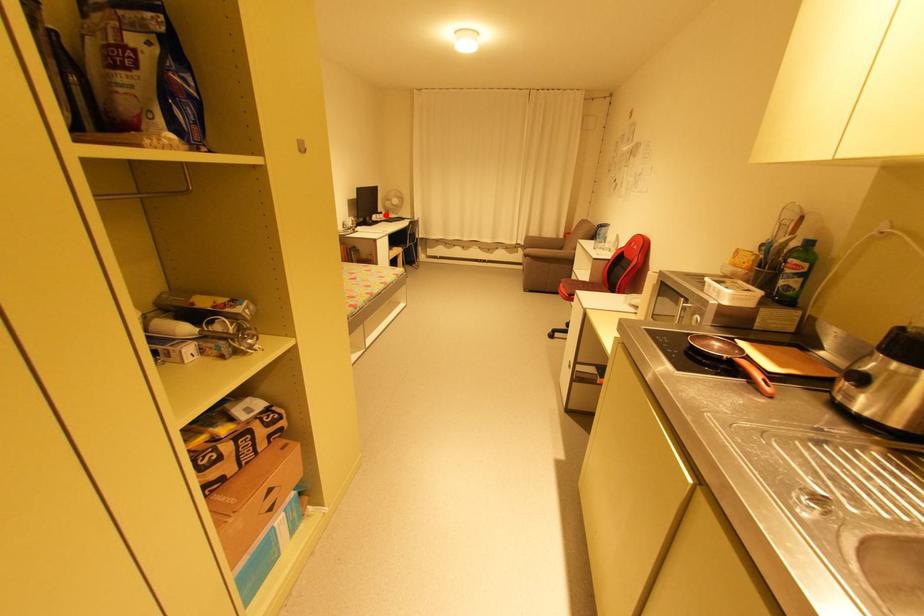
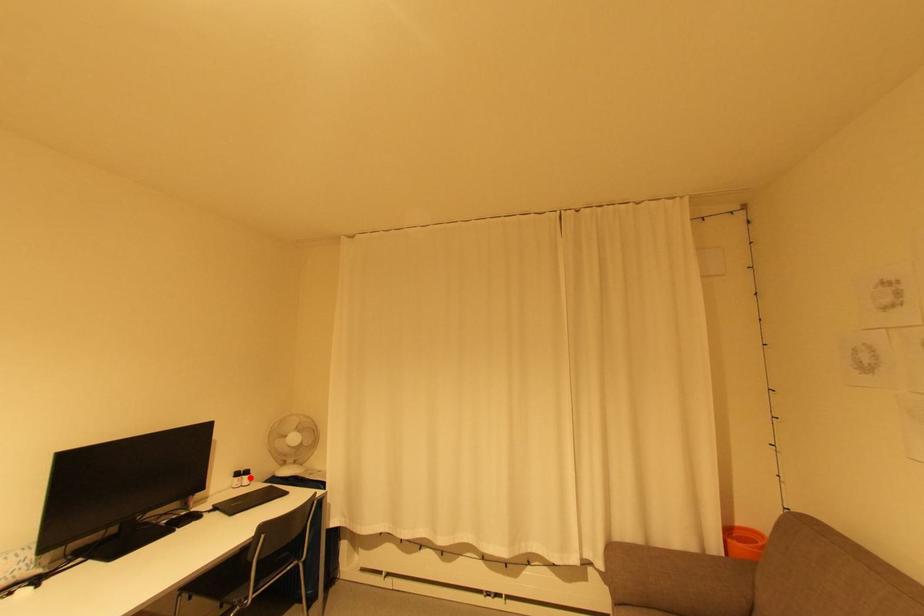
I am providing you with two images of the same scene from different viewpoints. A red point is marked on the first image and another point is marked on the second image. Is the red point in image1 aligned with the point shown in image2?

Yes